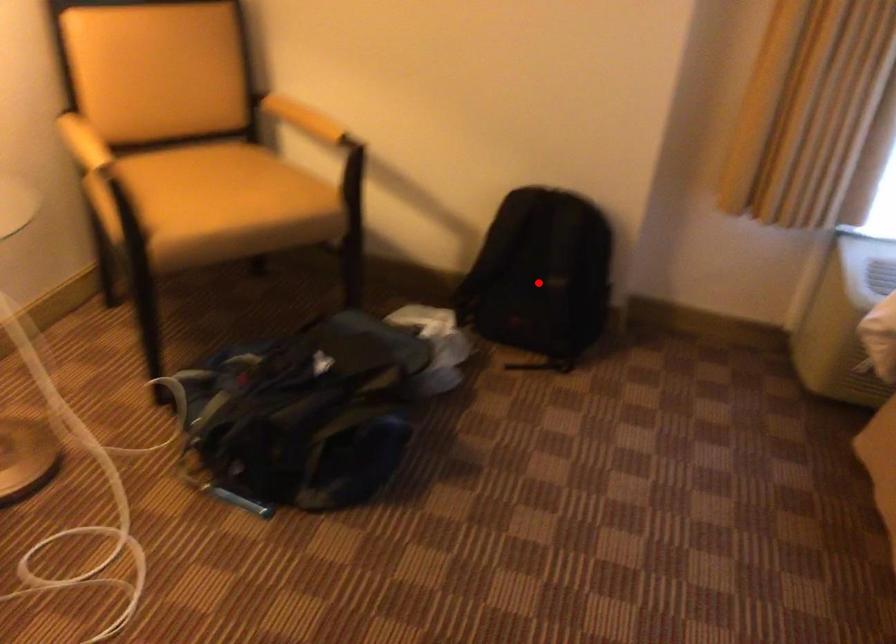
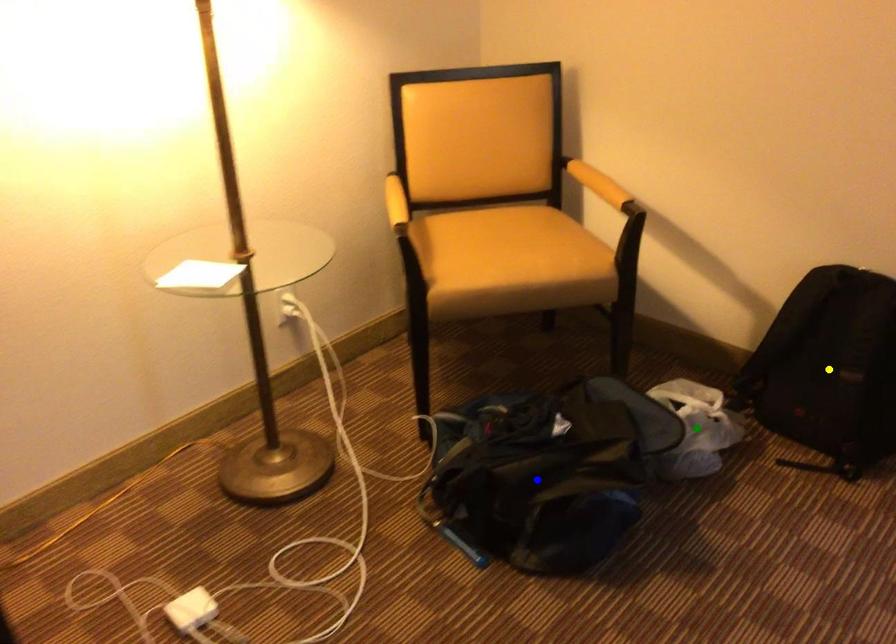
Question: I am providing you with two images of the same scene from different viewpoints. A red point is marked on the first image. You are given multiple points on the second image. Which spot in image 2 lines up with the point in image 1?

Choices:
 (A) yellow point
 (B) green point
 (C) blue point

Answer: (A)